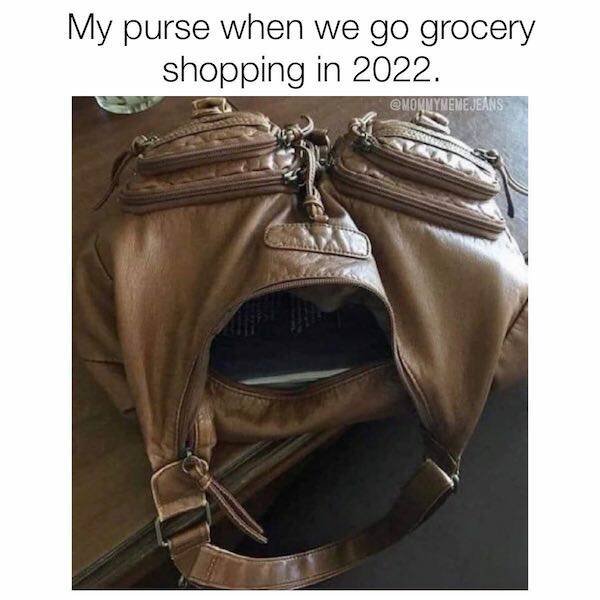
The image size is (600, 600). Identify the location of glass cup. (132, 105).